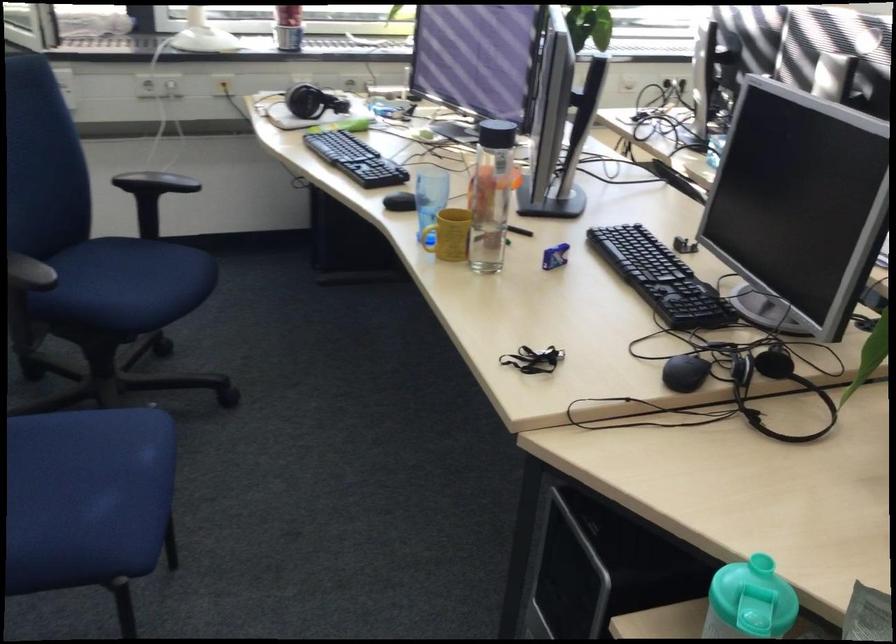
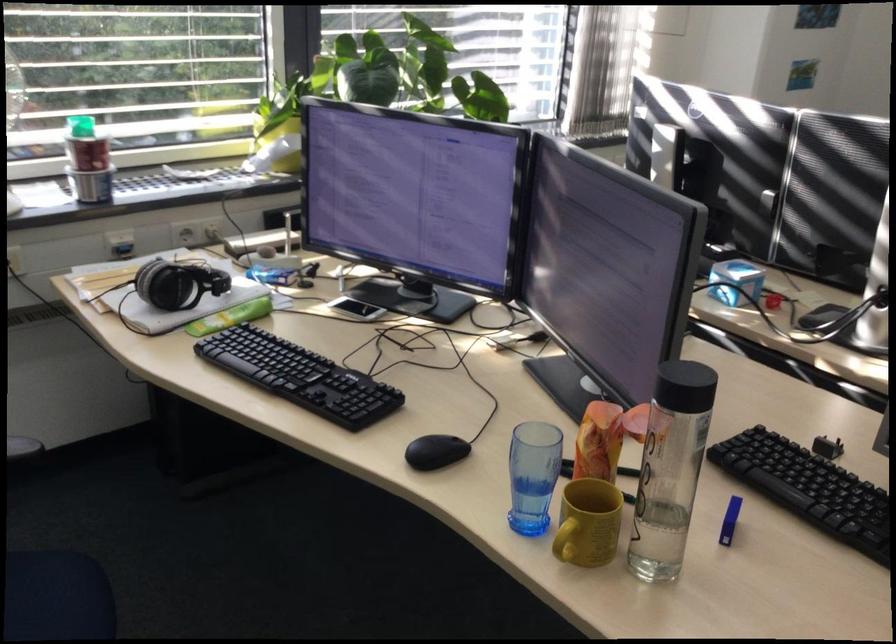
Where in the second image is the point corresponding to (x=307, y=96) from the first image?

(177, 283)